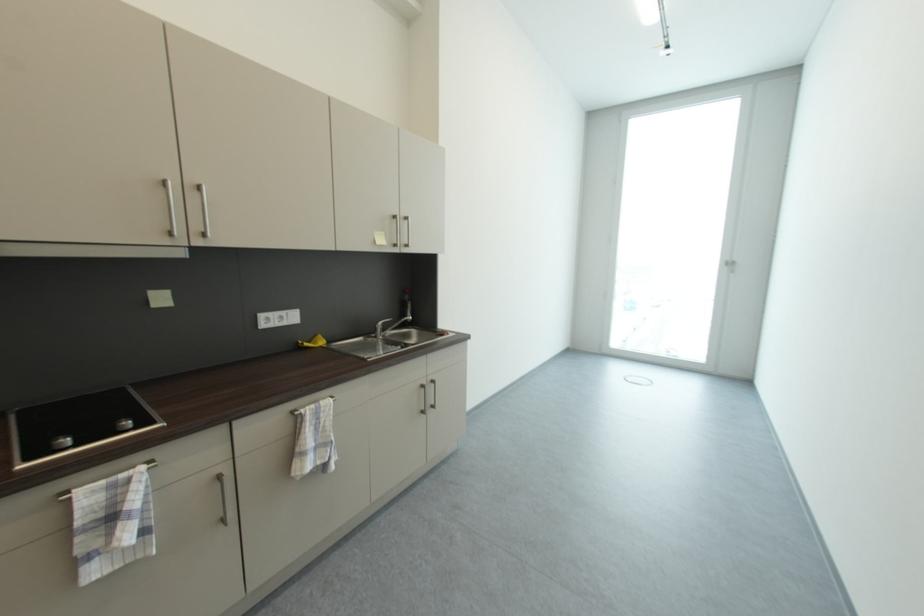
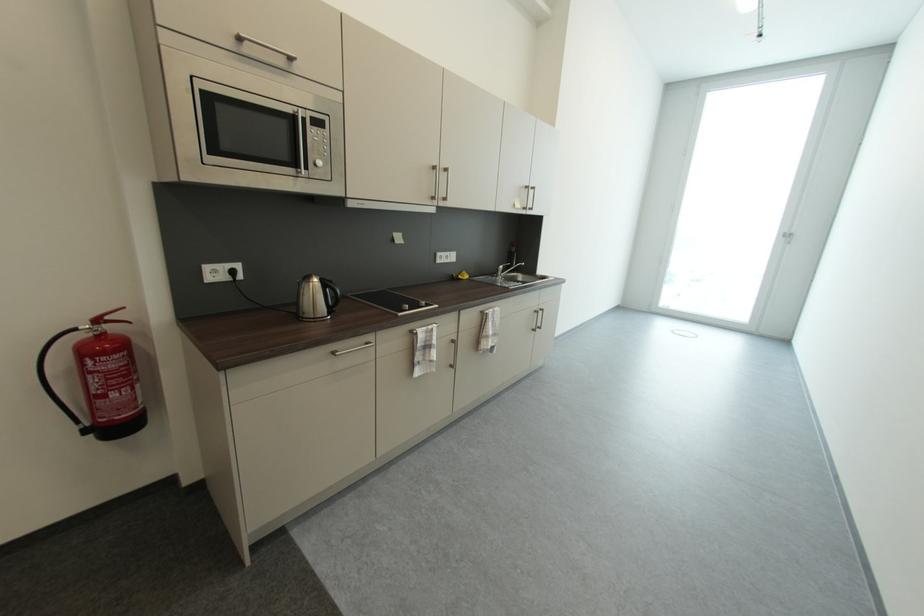
Where in the second image is the point corresponding to point (384, 246) from the first image?

(523, 209)